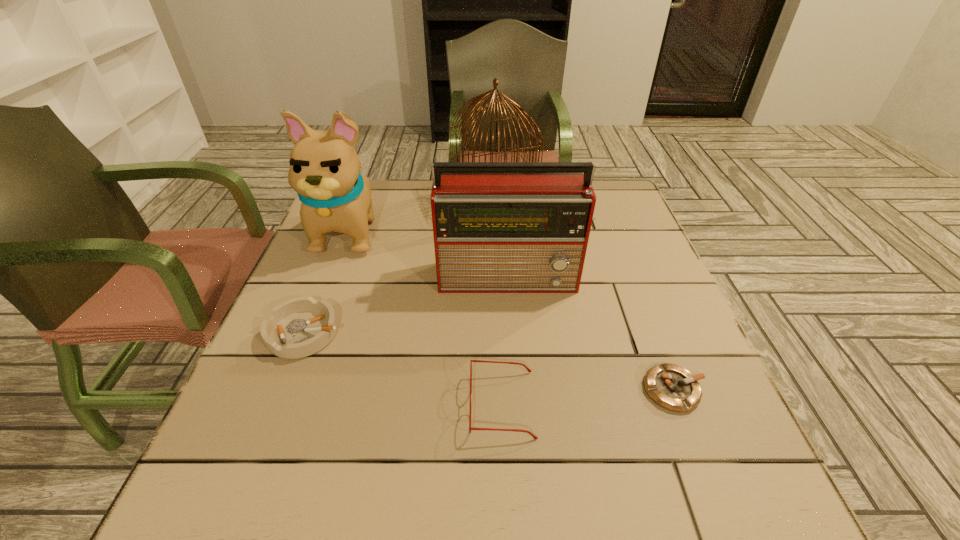
At what (x,y) coordinates should I click in order to perform the action: click on vacant space that satisfies the following two spatial constraints: 1. on the front side of the rightmost object; 2. on the face of the third shortest object. Please return your answer as a coordinate pair (x, y). Looking at the image, I should click on (680, 404).